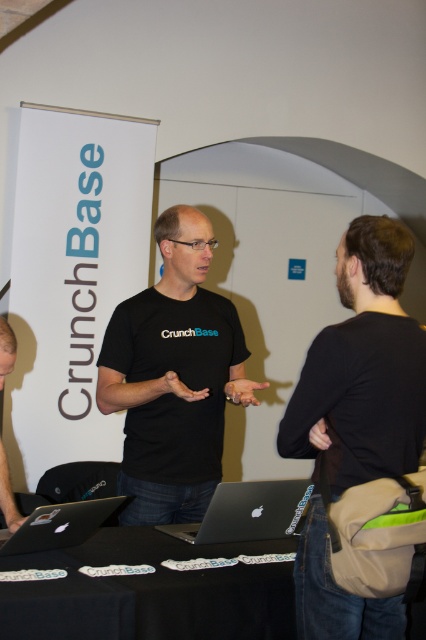
You are standing at the center of the scene. Which direction should you move to reach the black fabric backpack at right?

The black fabric backpack at right is located at the right side of the scene, so you should move to the right to reach it.

You are standing at the camera position and want to take a photo of the man on the left wearing the CrunchBase shirt. There is a point at coordinates (x=360, y=284) in the image that is 1.67 meters away from you. If you need to focus your camera at that point to capture the man clearly, will focusing at that point work for the man on the left?

The point at coordinates (x=360, y=284) is 1.67 meters from the camera. Since the man on the left is also within this distance range, focusing at that point should work to capture him clearly.